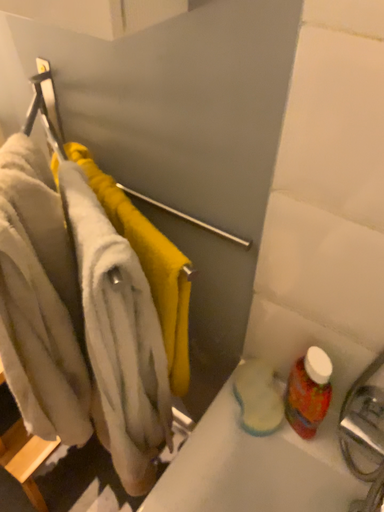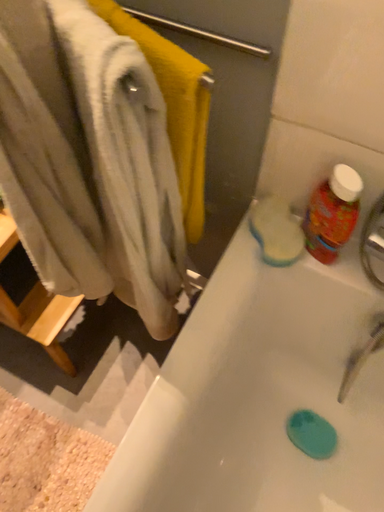
Question: Which way did the camera rotate in the video?

Choices:
 (A) rotated downward
 (B) rotated upward

Answer: (A)